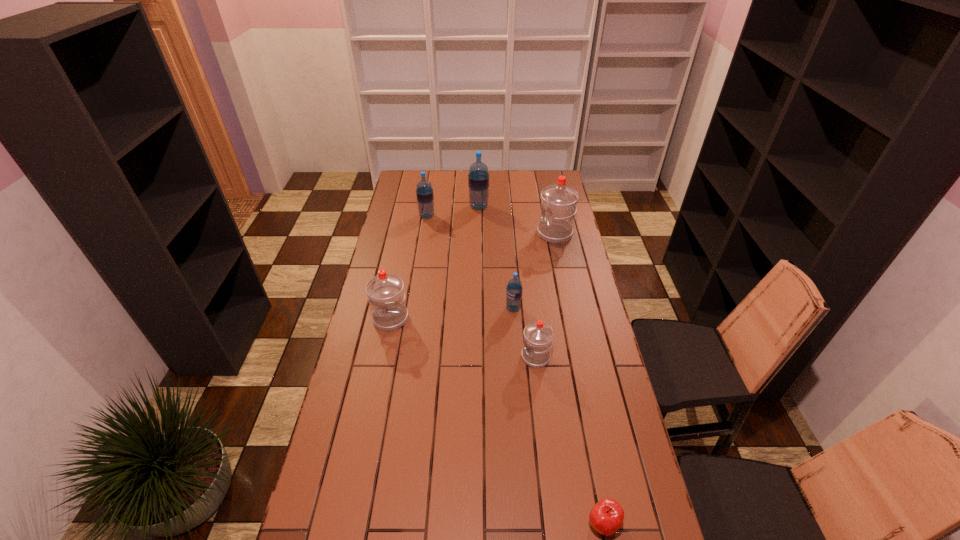
The height and width of the screenshot is (540, 960). I want to click on the second white water bottle from right to left, so click(538, 336).

Where is `free space located on the left of the fifth object from right to left`? Image resolution: width=960 pixels, height=540 pixels. free space located on the left of the fifth object from right to left is located at coordinates (418, 207).

This screenshot has width=960, height=540. I want to click on vacant space situated on the handle side of the third farthest object, so click(494, 234).

Where is `vacant space located 0.290m on the handle side of the third farthest object`? This screenshot has height=540, width=960. vacant space located 0.290m on the handle side of the third farthest object is located at coordinates (475, 234).

Where is `free space located 0.120m on the handle side of the third farthest object`? free space located 0.120m on the handle side of the third farthest object is located at coordinates (512, 234).

Where is `vacant space located 0.270m on the right of the leftmost blue water bottle`? This screenshot has width=960, height=540. vacant space located 0.270m on the right of the leftmost blue water bottle is located at coordinates (490, 216).

Identify the location of free space located 0.360m on the handle side of the second smallest white water bottle. (371, 421).

At what (x,y) coordinates should I click in order to perform the action: click on free space located on the front of the rightmost blue water bottle. Please return your answer as a coordinate pair (x, y). The width and height of the screenshot is (960, 540). Looking at the image, I should click on (520, 398).

Identify the location of vacant space located on the handle side of the second white water bottle from right to left. (413, 357).

This screenshot has width=960, height=540. I want to click on vacant point located 0.170m on the handle side of the second white water bottle from right to left, so click(473, 357).